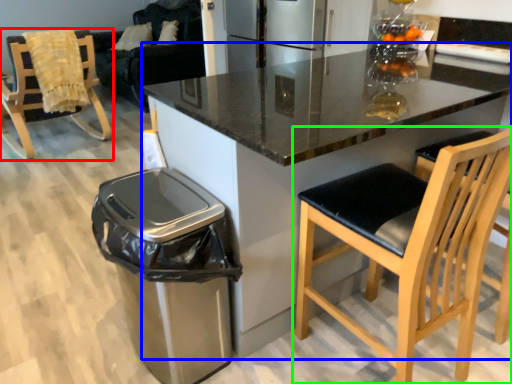
Question: Based on their relative distances, which object is nearer to chair (highlighted by a red box)? Choose from countertop (highlighted by a blue box) and chair (highlighted by a green box).

Choices:
 (A) countertop
 (B) chair

Answer: (A)